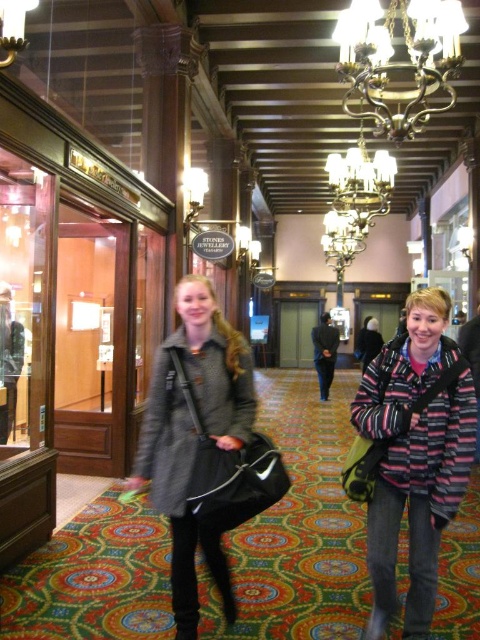
Based on the photo, can you confirm if striped woolen sweater at center is thinner than bronze metallic chandelier at upper center?

Yes, striped woolen sweater at center is thinner than bronze metallic chandelier at upper center.

Between point (436, 304) and point (411, 28), which one is positioned behind?

Point (411, 28)

Locate an element on the screen. This screenshot has height=640, width=480. striped woolen sweater at center is located at coordinates (415, 456).

From the picture: Who is more forward, (425, 413) or (250, 349)?

Point (425, 413) is in front.

Does striped woolen sweater at center have a smaller size compared to gray wool coat at center?

No, striped woolen sweater at center is not smaller than gray wool coat at center.

Where is `striped woolen sweater at center`? striped woolen sweater at center is located at coordinates (415, 456).

Is gray wool coat at center to the right of bronze metallic chandelier at upper center from the viewer's perspective?

No, gray wool coat at center is not to the right of bronze metallic chandelier at upper center.

Does gray wool coat at center lie in front of bronze metallic chandelier at upper center?

Yes, gray wool coat at center is in front of bronze metallic chandelier at upper center.

Measure the distance between point (197, 538) and camera.

Point (197, 538) and camera are 2.65 meters apart.

This screenshot has height=640, width=480. In order to click on gray wool coat at center in this screenshot , I will do `click(193, 436)`.